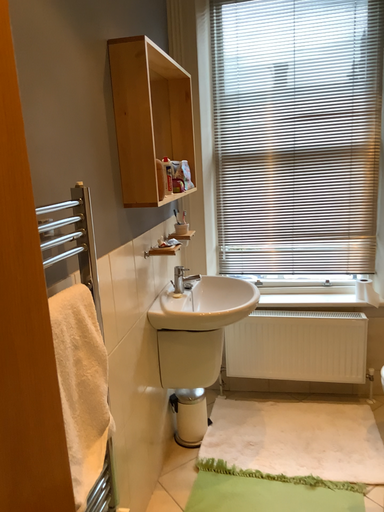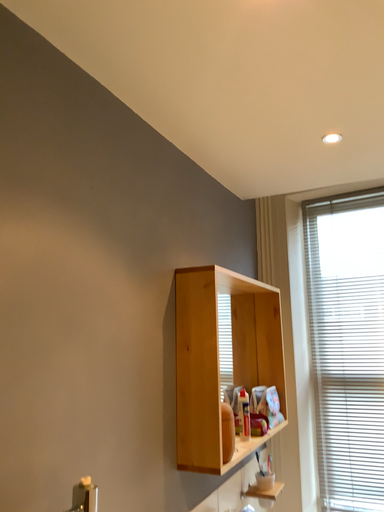
Question: Which way did the camera rotate in the video?

Choices:
 (A) rotated upward
 (B) rotated downward

Answer: (A)